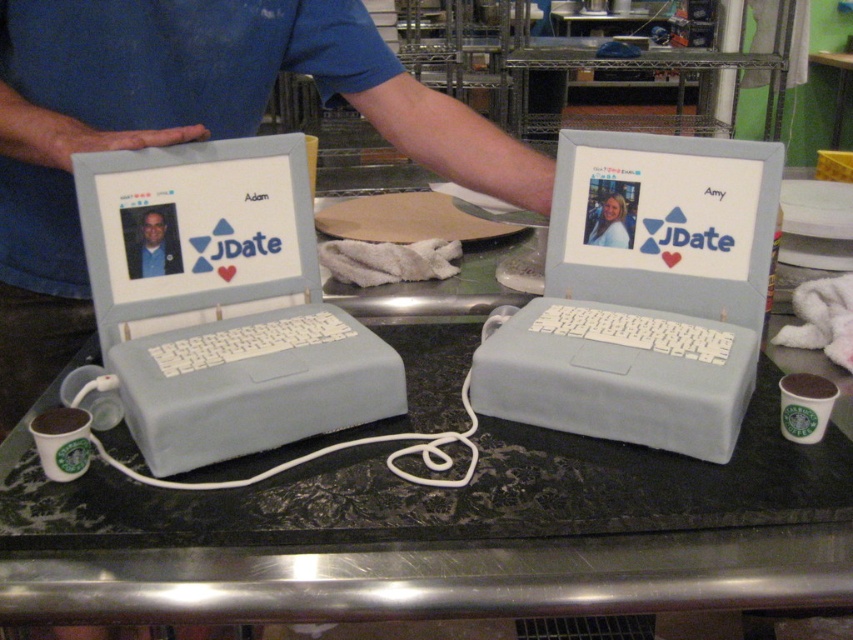
Question: Does gray fondant laptop at center appear on the left side of matte white cup at lower left?

Choices:
 (A) yes
 (B) no

Answer: (B)

Question: From the image, what is the correct spatial relationship of brushed metal laptop at center in relation to white matte coffee cup at lower left?

Choices:
 (A) left
 (B) right

Answer: (B)

Question: Which object is the closest to the blue fabric shirt at upper left?

Choices:
 (A) matte gray laptop at center
 (B) gray fondant laptop at center
 (C) matte white cup at lower left

Answer: (A)

Question: Does blue fabric shirt at upper left appear under white paper cup at lower right?

Choices:
 (A) yes
 (B) no

Answer: (B)

Question: Which of the following is the closest to the observer?

Choices:
 (A) (770, 349)
 (B) (134, 266)
 (C) (90, 93)
 (D) (503, 416)

Answer: (D)

Question: Which point appears closest to the camera in this image?

Choices:
 (A) (817, 376)
 (B) (128, 24)

Answer: (A)